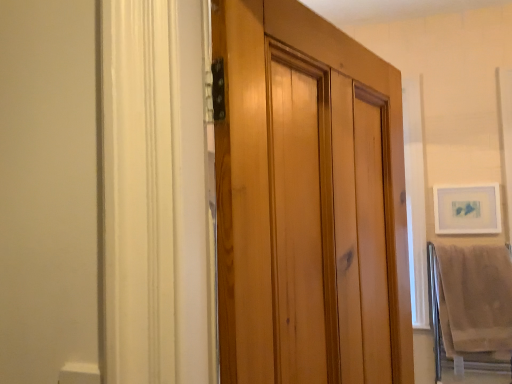
Question: Is matte white picture frame at upper right bigger than beige cotton bath towel at lower right?

Choices:
 (A) yes
 (B) no

Answer: (B)

Question: Is matte white picture frame at upper right surrounding beige cotton bath towel at lower right?

Choices:
 (A) yes
 (B) no

Answer: (B)

Question: Does matte white picture frame at upper right appear on the left side of beige cotton bath towel at lower right?

Choices:
 (A) yes
 (B) no

Answer: (B)

Question: Considering the relative sizes of matte white picture frame at upper right and beige cotton bath towel at lower right in the image provided, is matte white picture frame at upper right taller than beige cotton bath towel at lower right?

Choices:
 (A) no
 (B) yes

Answer: (A)

Question: Is matte white picture frame at upper right positioned in front of beige cotton bath towel at lower right?

Choices:
 (A) no
 (B) yes

Answer: (A)

Question: Is matte white picture frame at upper right aimed at beige cotton bath towel at lower right?

Choices:
 (A) no
 (B) yes

Answer: (A)

Question: Is beige cotton bath towel at lower right closer to the viewer compared to matte white picture frame at upper right?

Choices:
 (A) yes
 (B) no

Answer: (A)

Question: Is beige cotton bath towel at lower right at the left side of matte white picture frame at upper right?

Choices:
 (A) no
 (B) yes

Answer: (B)

Question: Is beige cotton bath towel at lower right next to matte white picture frame at upper right and touching it?

Choices:
 (A) no
 (B) yes

Answer: (A)

Question: Is beige cotton bath towel at lower right oriented away from matte white picture frame at upper right?

Choices:
 (A) yes
 (B) no

Answer: (B)

Question: Considering the relative sizes of beige cotton bath towel at lower right and matte white picture frame at upper right in the image provided, is beige cotton bath towel at lower right taller than matte white picture frame at upper right?

Choices:
 (A) no
 (B) yes

Answer: (B)

Question: From the image's perspective, does beige cotton bath towel at lower right appear lower than matte white picture frame at upper right?

Choices:
 (A) no
 (B) yes

Answer: (B)

Question: Relative to matte white picture frame at upper right, is beige cotton bath towel at lower right in front or behind?

Choices:
 (A) behind
 (B) front

Answer: (B)